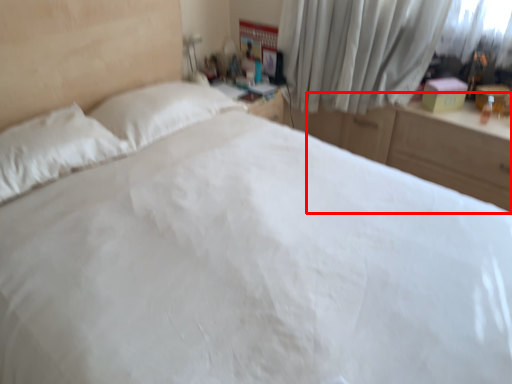
Question: From the image's perspective, what is the correct spatial positioning of dresser (annotated by the red box) in reference to curtain?

Choices:
 (A) above
 (B) below

Answer: (B)